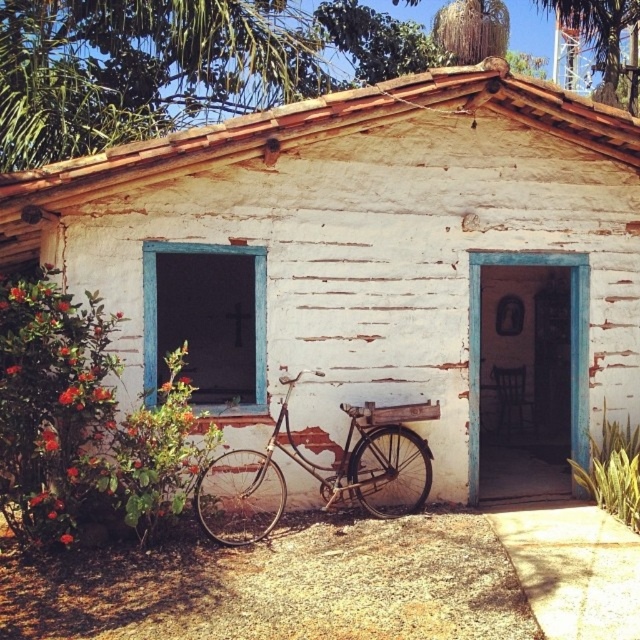
You are standing at the entrance of the white weathered wood hut at center and want to place a 10 feet long wooden bench in front of it. Is there enough space between the entrance and the bicycle to place the bench?

The distance between the entrance and the bicycle is 38.86 feet, which is more than enough to place a 10 feet long wooden bench.